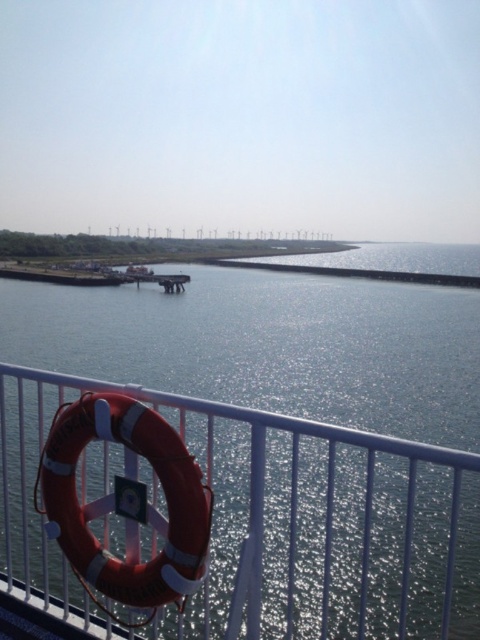
Question: Which of the following is the closest to the observer?

Choices:
 (A) rubber life ring at lower left
 (B) white metal fence at lower center

Answer: (B)

Question: Is white metal fence at lower center to the left of rubber life ring at lower left from the viewer's perspective?

Choices:
 (A) no
 (B) yes

Answer: (A)

Question: Considering the relative positions of white metal fence at lower center and rubber life ring at lower left in the image provided, where is white metal fence at lower center located with respect to rubber life ring at lower left?

Choices:
 (A) left
 (B) right

Answer: (B)

Question: Where is white metal fence at lower center located in relation to rubber life ring at lower left in the image?

Choices:
 (A) below
 (B) above

Answer: (A)